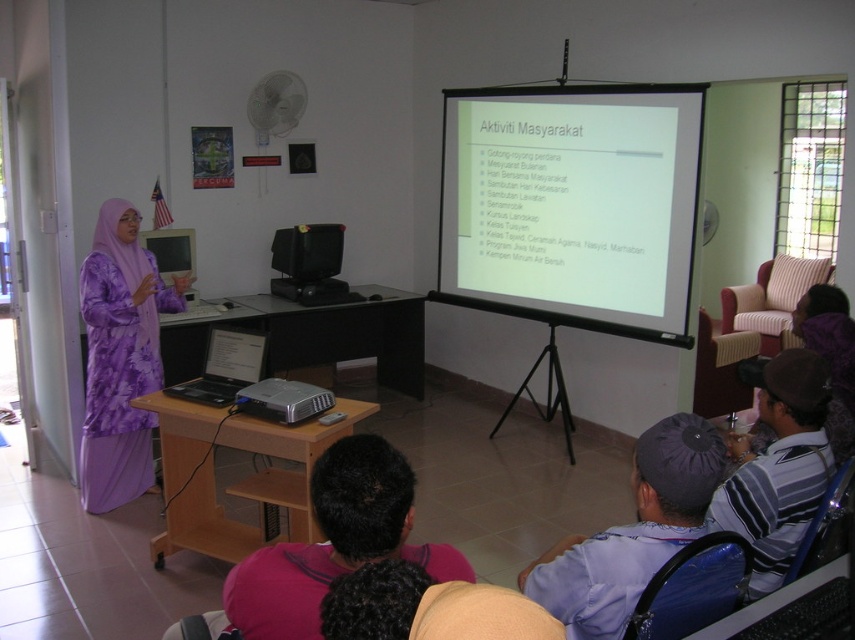
You are a student sitting in the classroom and want to reach the blue fabric robe at lower right without moving past the black matte table at center. Is this possible?

The black matte table at center is further to the viewer than blue fabric robe at lower right, so you can reach the blue fabric robe at lower right without moving past the black matte table at center.

You are a student sitting in the classroom and notice two items on the desk. The dark blue fabric cap at lower center and the matte black laptop at center. Which item takes up more space on the desk?

The dark blue fabric cap at lower center has a larger size compared to the matte black laptop at center, so it takes up more space on the desk.

You are a student sitting at the back of the classroom and need to reach the black matte table at center to borrow a pen. Can you estimate how far you need to walk from your seat to the table?

The black matte table at center is located at point (313, 337) in the image, but without knowing the scale or the dimensions of the classroom, it is impossible to estimate the exact distance you need to walk to reach it.